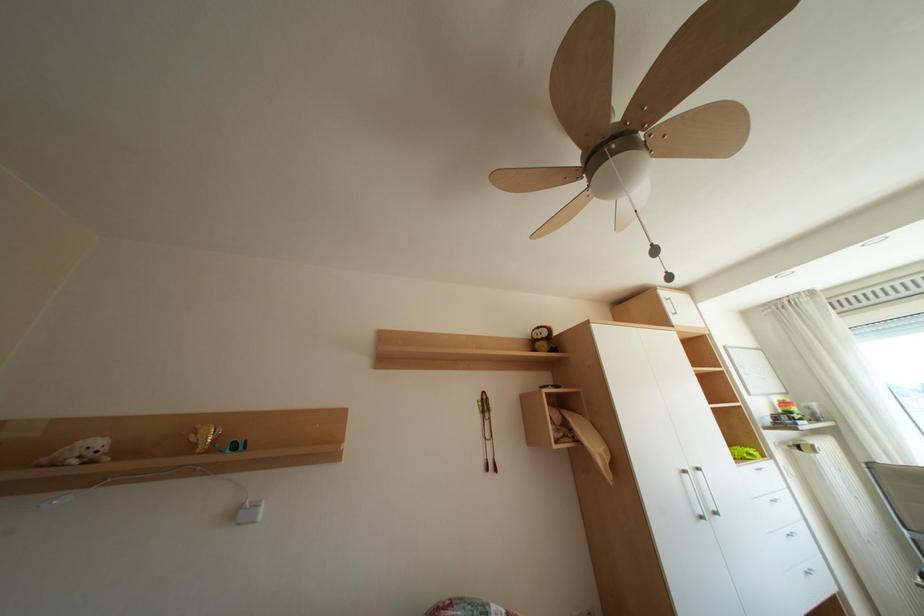
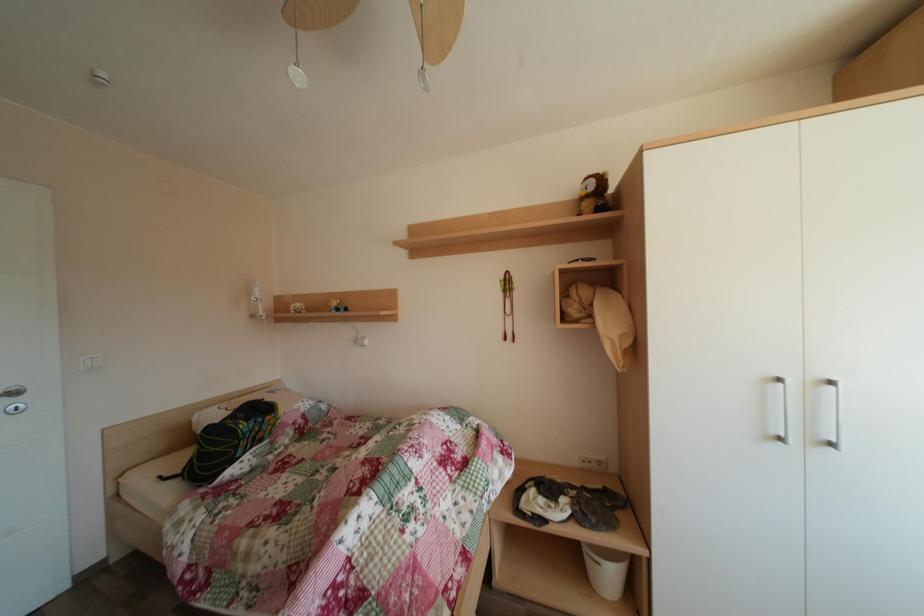
Based on the continuous images, in which direction is the camera rotating?

The camera's rotation is toward left-down.